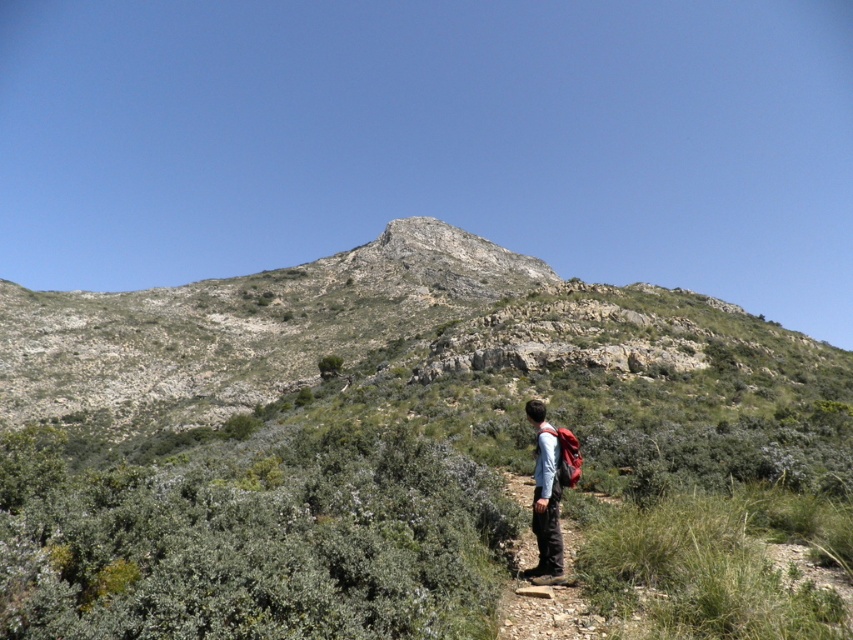
Who is more forward, (547, 275) or (532, 420)?

Point (532, 420) is more forward.

Looking at this image, can you confirm if rugged stone mountain at center is bigger than matte blue shirt at center?

Indeed, rugged stone mountain at center has a larger size compared to matte blue shirt at center.

You are a GUI agent. You are given a task and a screenshot of the screen. Output one action in this format:
    pyautogui.click(x=<x>, y=<y>)
    Task: Click on the rugged stone mountain at center
    This screenshot has height=640, width=853.
    Given the screenshot: What is the action you would take?
    pyautogui.click(x=242, y=324)